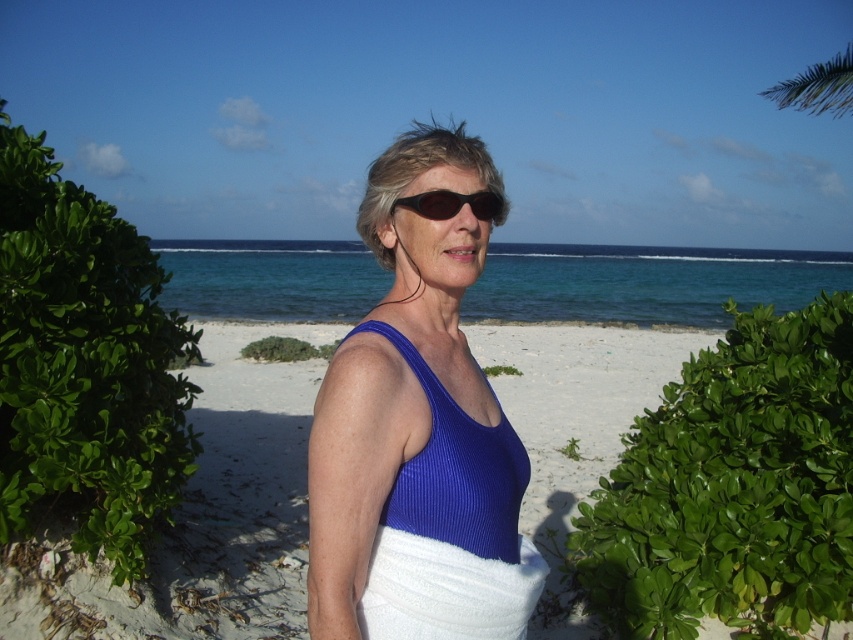
You are a photographer trying to capture the best shot of the white terry cloth towel at lower center. According to the coordinates provided, where should you position your camera to ensure the towel is centered in the frame?

To center the white terry cloth towel at lower center in the frame, position your camera at coordinates approximately at point (445, 589).

You are standing at the beach and want to reach the point marked as point (512, 412). If you walk straight ahead, how far will you have to walk to reach that point?

You will have to walk 8.86 meters to reach point (512, 412) since the distance between the viewer and that point is 8.86 meters.

You are a photographer trying to capture the blue ribbed tank top at center in the frame. Based on the coordinates provided, where should you position your camera to ensure the tank top is centered?

The blue ribbed tank top at center is located at coordinates point (413, 404), so positioning the camera to aim directly at those coordinates will center it in the frame.